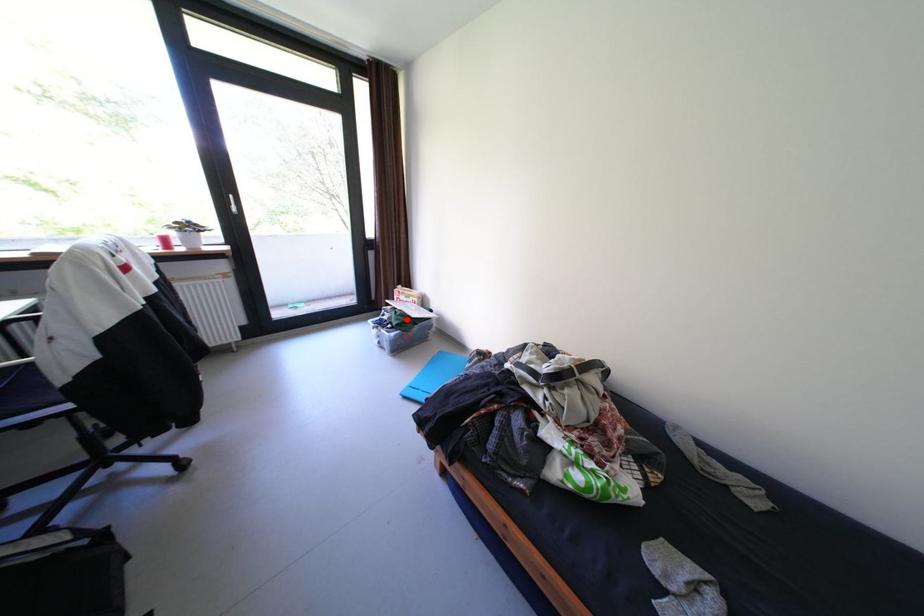
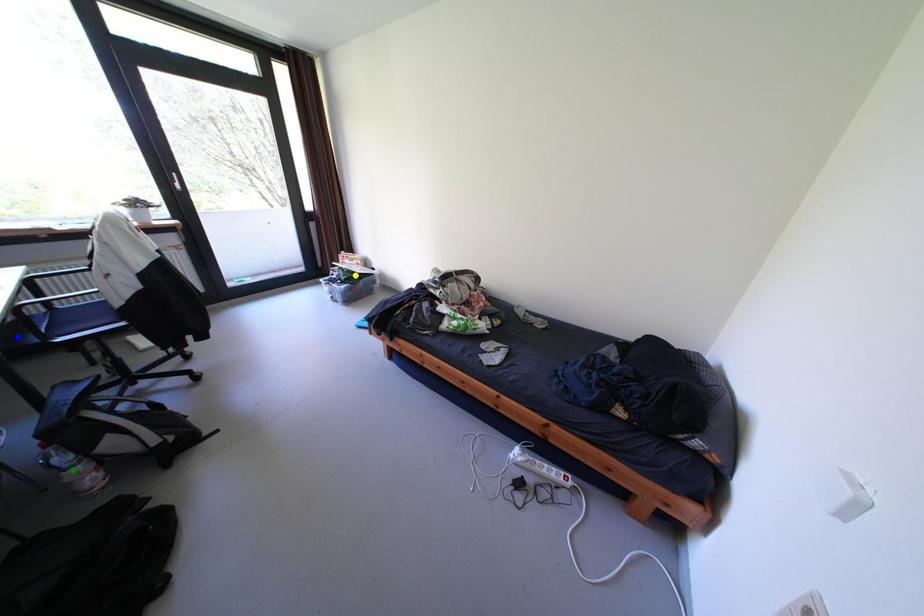
Question: I am providing you with two images of the same scene from different viewpoints. A red point is marked on the first image. You are given multiple points on the second image. Which point in image 2 represents the same 3d spot as the red point in image 1?

Choices:
 (A) yellow point
 (B) green point
 (C) blue point

Answer: (A)